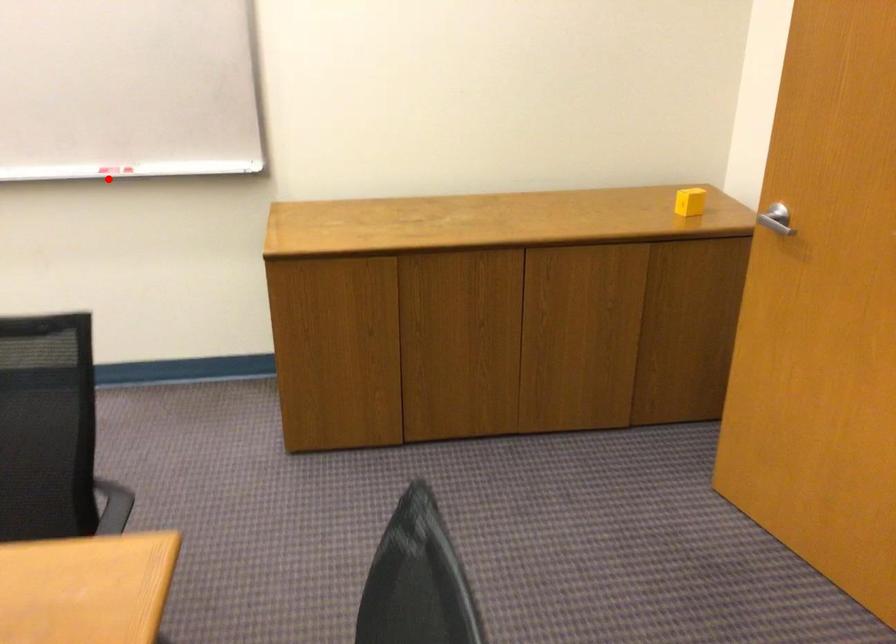
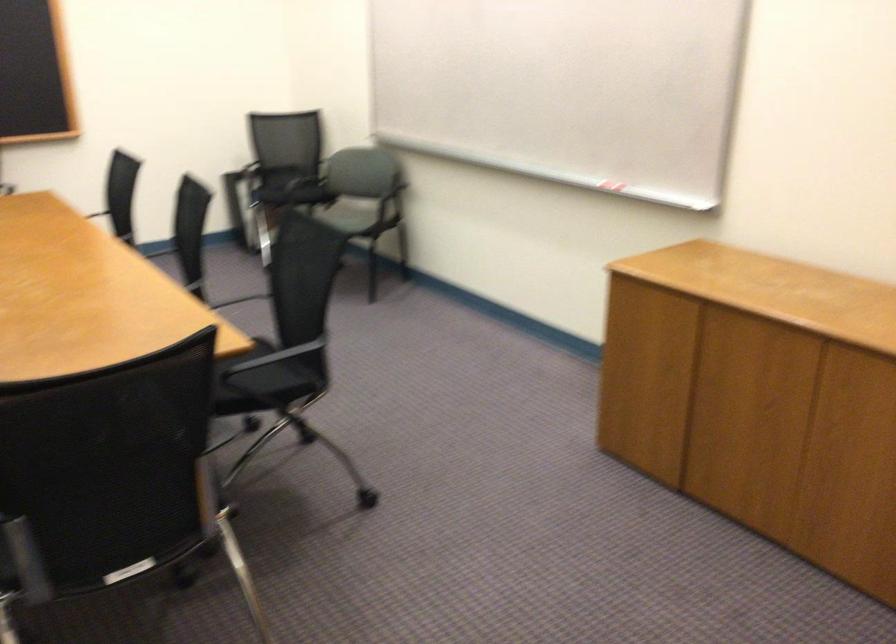
Question: I am providing you with two images of the same scene from different viewpoints. A red point is shown in image1. For the corresponding object point in image2, is it positioned nearer or farther from the camera?

Choices:
 (A) Nearer
 (B) Farther

Answer: (B)